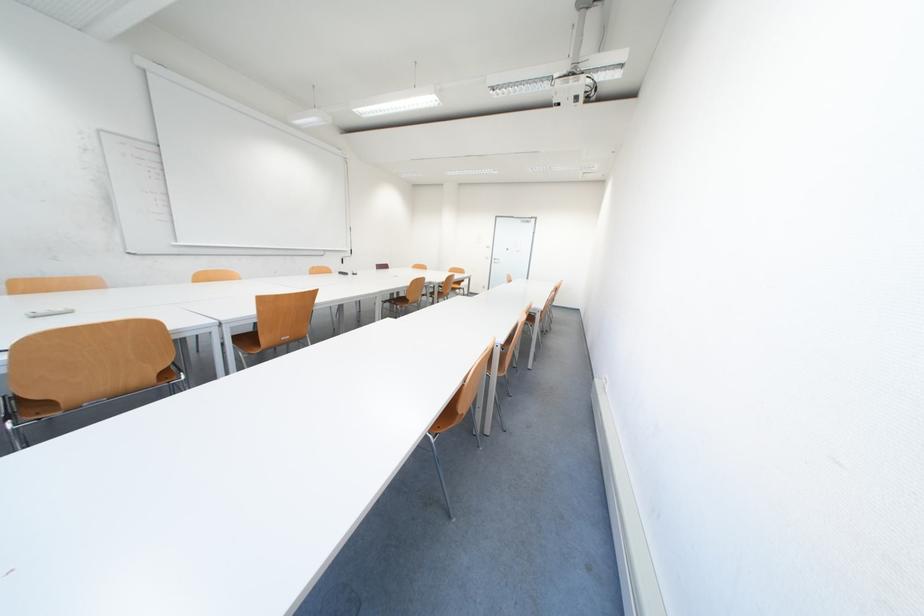
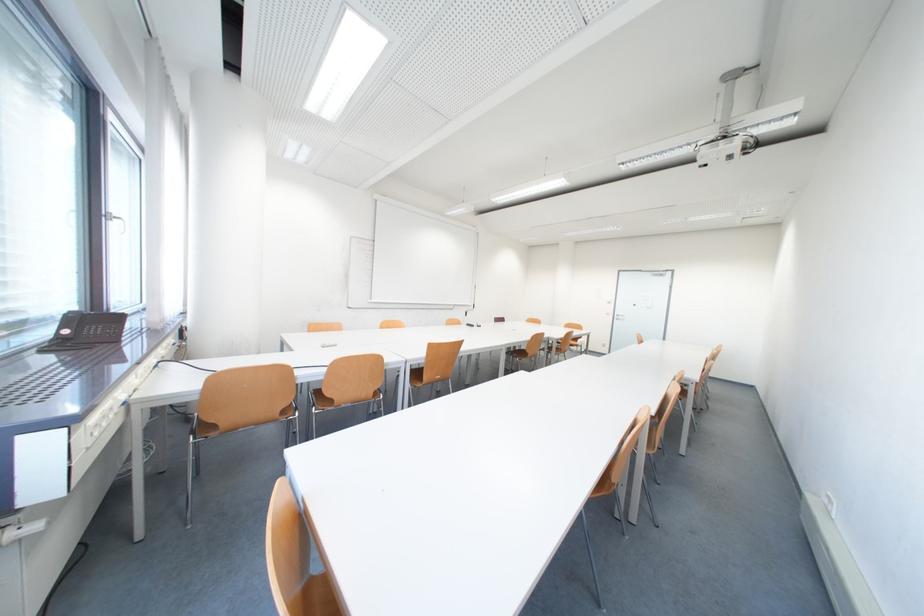
Question: The camera is either moving clockwise (left) or counter-clockwise (right) around the object. The first image is from the beginning of the video and the second image is from the end. Is the camera moving left or right when shooting the video?

Choices:
 (A) Left
 (B) Right

Answer: (B)